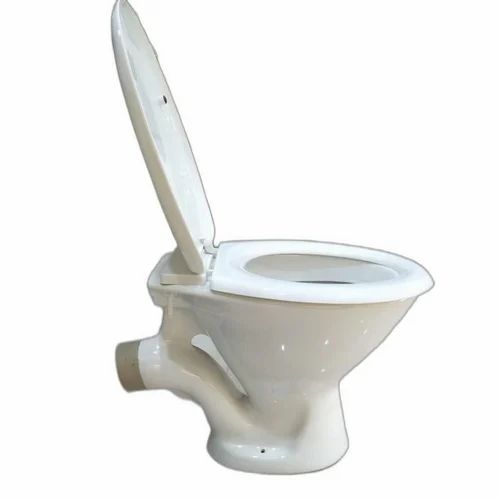
At what (x,y) coordinates should I click in order to perform the action: click on toilet pipe cap. Please return your answer as a coordinate pair (x, y). This screenshot has height=500, width=500. Looking at the image, I should click on (123, 376).